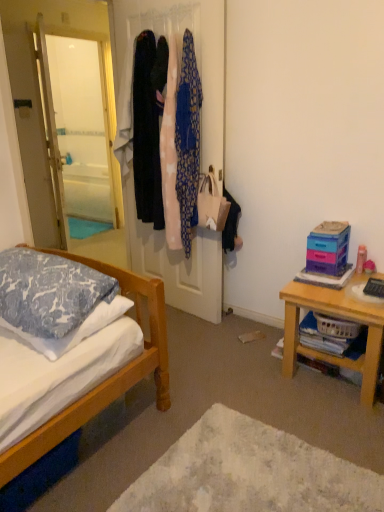
Where is `empty space that is ontop of white soft rug at lower center (from a real-world perspective)`? Image resolution: width=384 pixels, height=512 pixels. empty space that is ontop of white soft rug at lower center (from a real-world perspective) is located at coordinates (232, 473).